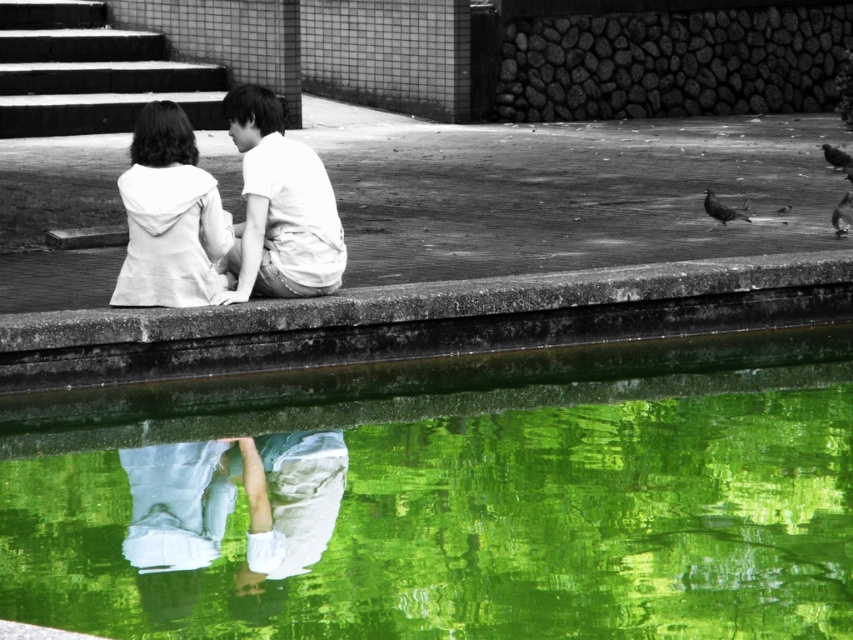
Question: Is green reflective water at center in front of dark gray feathered bird at upper right?

Choices:
 (A) no
 (B) yes

Answer: (B)

Question: Among these points, which one is nearest to the camera?

Choices:
 (A) (737, 209)
 (B) (850, 227)

Answer: (B)

Question: Which of the following is the closest to the observer?

Choices:
 (A) dark gray feathered bird at upper right
 (B) white matte hoodie at upper left
 (C) white cotton hoodie at upper center

Answer: (C)

Question: Considering the relative positions of dark gray feathered bird at right and smooth black bird at upper right in the image provided, where is dark gray feathered bird at right located with respect to smooth black bird at upper right?

Choices:
 (A) left
 (B) right

Answer: (A)

Question: Which of the following is the closest to the observer?

Choices:
 (A) (241, 120)
 (B) (741, 211)
 (C) (554, 566)
 (D) (849, 218)

Answer: (C)

Question: Can you confirm if green reflective water at center is positioned above concrete ledge at center?

Choices:
 (A) yes
 (B) no

Answer: (B)